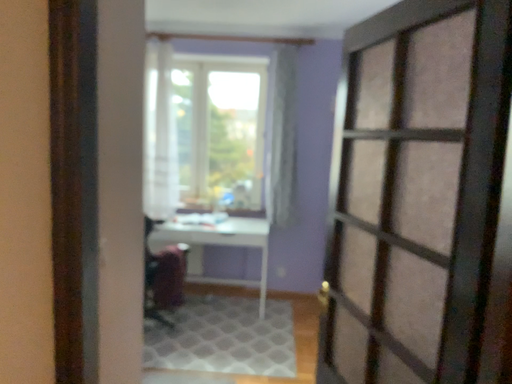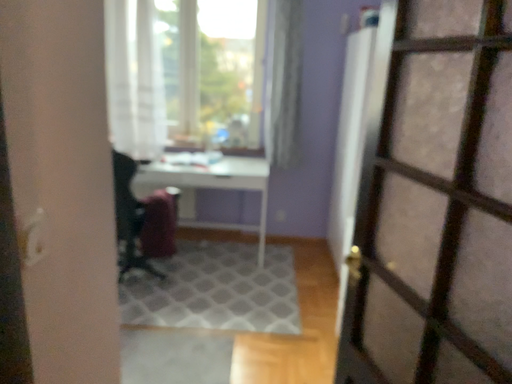
Question: How did the camera likely rotate when shooting the video?

Choices:
 (A) rotated downward
 (B) rotated upward

Answer: (A)